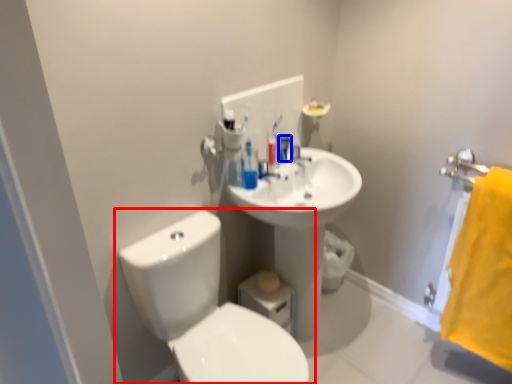
Question: Which object appears closest to the camera in this image, toilet (highlighted by a red box) or mouthwash (highlighted by a blue box)?

Choices:
 (A) toilet
 (B) mouthwash

Answer: (A)